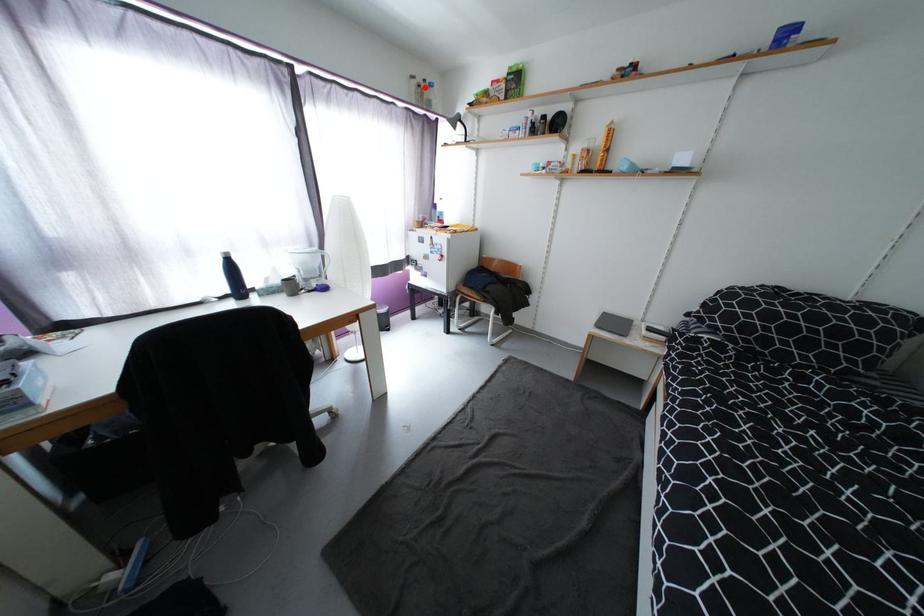
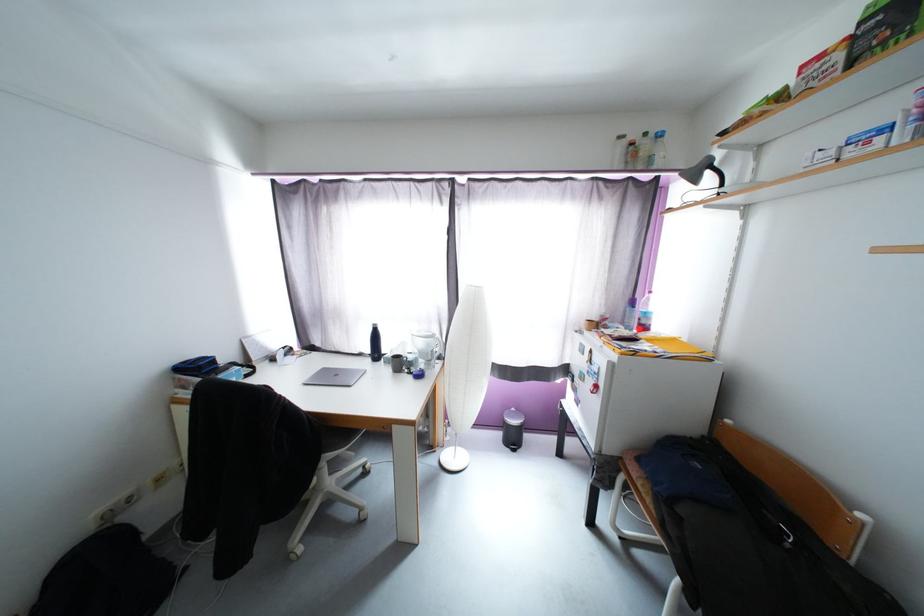
Locate, in the second image, the point that corresponds to the highlighted location in the first image.

(638, 146)